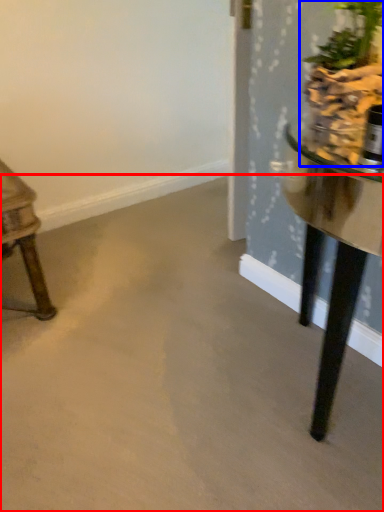
Question: Among these objects, which one is farthest to the camera, concrete (highlighted by a red box) or houseplant (highlighted by a blue box)?

Choices:
 (A) concrete
 (B) houseplant

Answer: (B)